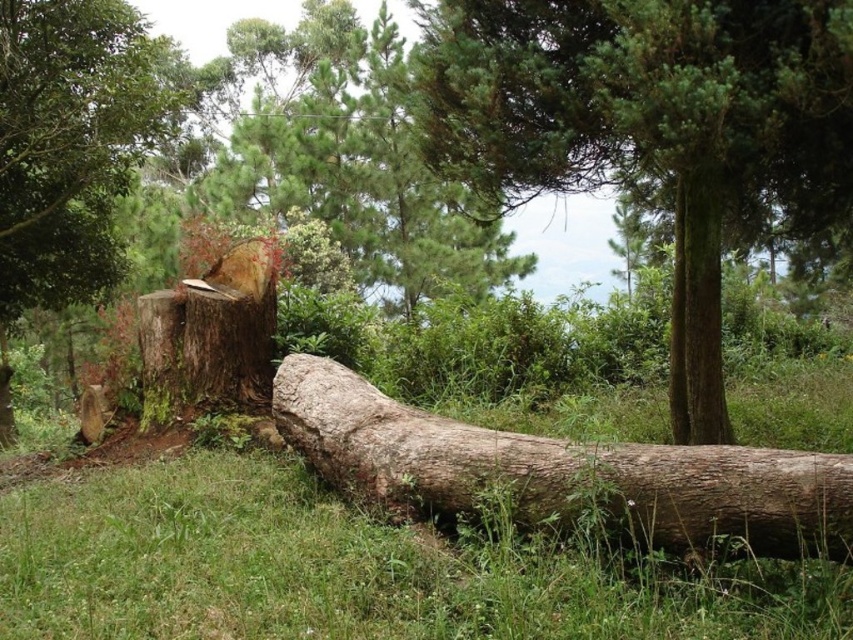
Question: Is green rough bark tree at center closer to the viewer compared to brown rough wood stump at center?

Choices:
 (A) yes
 (B) no

Answer: (A)

Question: Which point appears farthest from the camera in this image?

Choices:
 (A) (709, 256)
 (B) (85, 84)

Answer: (B)

Question: Which object is the closest to the green rough bark tree trunk at right?

Choices:
 (A) brown rough wood stump at center
 (B) brown rough tree stump at left
 (C) green rough bark tree at center
 (D) brown rough log at center

Answer: (C)

Question: Is brown rough tree stump at left positioned at the back of green rough bark tree trunk at right?

Choices:
 (A) yes
 (B) no

Answer: (A)

Question: Can you confirm if brown rough wood stump at center is positioned to the left of green rough bark tree trunk at right?

Choices:
 (A) no
 (B) yes

Answer: (B)

Question: Which object is the farthest from the green rough bark tree trunk at right?

Choices:
 (A) brown rough log at center
 (B) brown rough tree stump at left

Answer: (B)